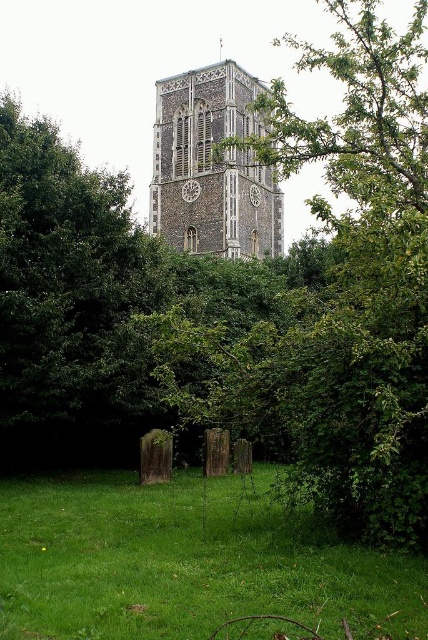
Is point (425, 412) more distant than point (225, 177)?

No, (425, 412) is closer to viewer.

Identify the location of green leafy tree at center. (359, 280).

Who is more distant from viewer, (x=412, y=326) or (x=383, y=620)?

Point (x=412, y=326)

The height and width of the screenshot is (640, 428). Describe the element at coordinates (359, 280) in the screenshot. I see `green leafy tree at center` at that location.

Is point (383, 109) behind point (285, 541)?

Yes.

Identify the location of green leafy tree at center. pos(359,280).

Between green grass at lower center and stone clock tower at center, which one appears on the left side from the viewer's perspective?

green grass at lower center is more to the left.

The height and width of the screenshot is (640, 428). What are the coordinates of `green grass at lower center` in the screenshot? It's located at (184, 563).